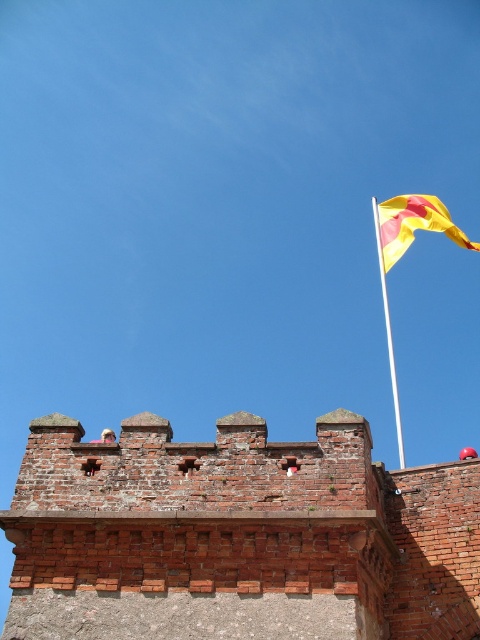
Question: Which object is farther from the camera taking this photo?

Choices:
 (A) red brick wall at upper center
 (B) yellow fabric flag at upper right

Answer: (B)

Question: Is red brick wall at upper center above yellow fabric flag at upper right?

Choices:
 (A) no
 (B) yes

Answer: (A)

Question: Is red brick wall at upper center closer to camera compared to yellow fabric flag at upper right?

Choices:
 (A) yes
 (B) no

Answer: (A)

Question: Does yellow fabric flag at upper right have a smaller size compared to white metallic flag pole at upper right?

Choices:
 (A) no
 (B) yes

Answer: (B)

Question: Among these points, which one is nearest to the camera?

Choices:
 (A) pos(421,220)
 (B) pos(377,244)

Answer: (A)

Question: Which object appears farthest from the camera in this image?

Choices:
 (A) yellow fabric flag at upper right
 (B) white metallic flag pole at upper right
 (C) red brick wall at upper center

Answer: (B)